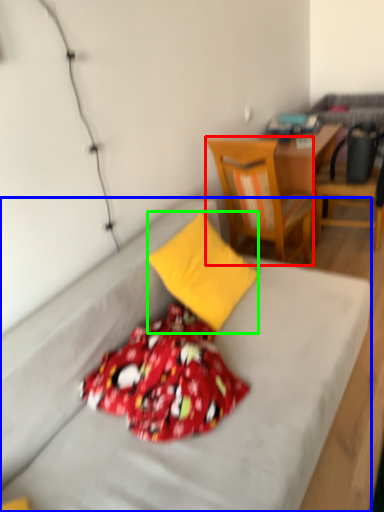
Question: Considering the real-world distances, which object is farthest from chair (highlighted by a red box)? bed (highlighted by a blue box) or pillow (highlighted by a green box)?

Choices:
 (A) bed
 (B) pillow

Answer: (A)